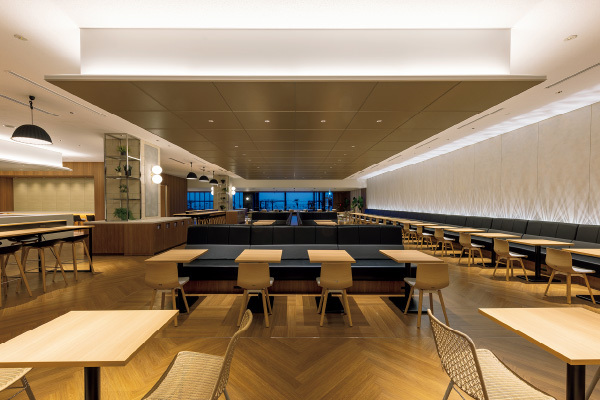
This screenshot has height=400, width=600. Find the location of `decorative green plants on shelves`. decorative green plants on shelves is located at coordinates [121, 212], [124, 191], [118, 167], [127, 170], [122, 148].